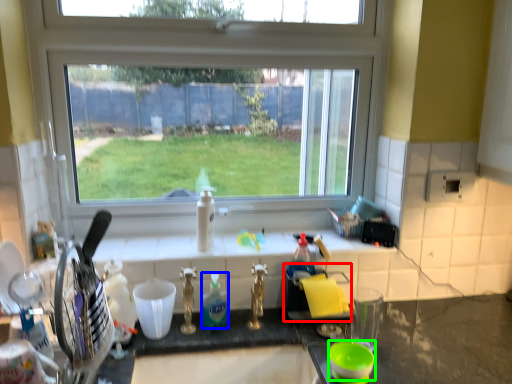
Question: Which object is the closest to the appliance (highlighted by a red box)? Choose among these: bottle (highlighted by a blue box) or basin (highlighted by a green box).

Choices:
 (A) bottle
 (B) basin

Answer: (A)